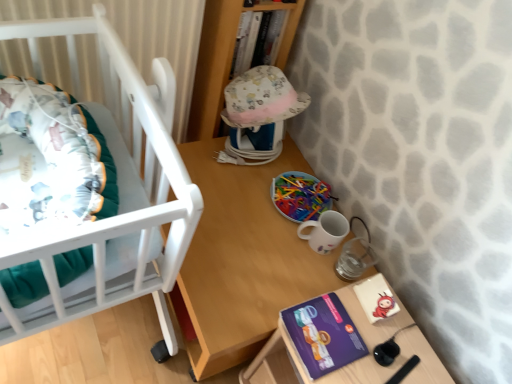
This screenshot has height=384, width=512. What do you see at coordinates (242, 260) in the screenshot? I see `wooden table at center` at bounding box center [242, 260].

In order to face hardcover book at upper center, should I rotate leftwards or rightwards?

Rotate your view left by about 0.839°.

The image size is (512, 384). I want to click on multicolored plastic sticks at center, so click(x=300, y=196).

Is wooden table at center smaller than white glossy mug at lower right?

Incorrect, wooden table at center is not smaller in size than white glossy mug at lower right.

Is point (281, 219) positioned behind point (311, 233)?

Yes, point (281, 219) is behind point (311, 233).

Considering the sizes of objects wooden table at center and white glossy mug at lower right in the image provided, who is taller, wooden table at center or white glossy mug at lower right?

With more height is wooden table at center.

From a real-world perspective, is purple cardboard box at lower right physically above white glossy mug at lower right?

No.

From the image's perspective, is purple cardboard box at lower right located above or below white glossy mug at lower right?

purple cardboard box at lower right is below white glossy mug at lower right.

Is purple cardboard box at lower right situated inside white glossy mug at lower right or outside?

purple cardboard box at lower right is not enclosed by white glossy mug at lower right.

Is purple cardboard box at lower right not near white glossy mug at lower right?

No.

Is multicolored plastic sticks at center not inside purple cardboard box at lower right?

multicolored plastic sticks at center is positioned outside purple cardboard box at lower right.

Is multicolored plastic sticks at center oriented away from purple cardboard box at lower right?

No, purple cardboard box at lower right is not at the back of multicolored plastic sticks at center.

Which object is further away from the camera taking this photo, multicolored plastic sticks at center or purple cardboard box at lower right?

multicolored plastic sticks at center.

Identify the location of changing table below the multicolored plastic sticks at center (from a real-world perspective). (356, 360).

Can you see purple matte paperback book at lower right touching white glossy mug at lower right?

No, purple matte paperback book at lower right is not beside white glossy mug at lower right.

Does purple matte paperback book at lower right have a lesser height compared to white glossy mug at lower right?

Indeed, purple matte paperback book at lower right has a lesser height compared to white glossy mug at lower right.

Is purple matte paperback book at lower right further to the viewer compared to white glossy mug at lower right?

No, purple matte paperback book at lower right is closer to the camera.

Locate an element on the screen. This screenshot has height=384, width=512. paperback book in front of the white glossy mug at lower right is located at coordinates (323, 334).

Between hardcover book at upper center and purple matte paperback book at lower right, which one is positioned behind?

Positioned behind is hardcover book at upper center.

Does hardcover book at upper center appear on the left side of purple matte paperback book at lower right?

Yes, hardcover book at upper center is to the left of purple matte paperback book at lower right.

Who is shorter, hardcover book at upper center or purple matte paperback book at lower right?

Standing shorter between the two is purple matte paperback book at lower right.

Is hardcover book at upper center positioned beyond the bounds of wooden table at center?

Indeed, hardcover book at upper center is completely outside wooden table at center.

From the image's perspective, which object appears higher, hardcover book at upper center or wooden table at center?

hardcover book at upper center.

Where is `book above the wooden table at center (from the image's perspective)`? book above the wooden table at center (from the image's perspective) is located at coordinates (258, 39).

Between purple matte paperback book at lower right and wooden table at center, which one has smaller size?

purple matte paperback book at lower right is smaller.

From the image's perspective, is purple matte paperback book at lower right over wooden table at center?

No, from the image's perspective, purple matte paperback book at lower right is not above wooden table at center.

Between purple matte paperback book at lower right and wooden table at center, which one appears on the right side from the viewer's perspective?

purple matte paperback book at lower right is more to the right.

Considering the sizes of objects purple matte paperback book at lower right and wooden table at center in the image provided, who is shorter, purple matte paperback book at lower right or wooden table at center?

purple matte paperback book at lower right.

This screenshot has width=512, height=384. What are the coordinates of `table lying in front of the white glossy mug at lower right` in the screenshot? It's located at (242, 260).

You are a GUI agent. You are given a task and a screenshot of the screen. Output one action in this format:
    pyautogui.click(x=<x>, y=<y>)
    Task: Click on the mug above the purple cardboard box at lower right (from a real-world perspective)
    This screenshot has width=512, height=384.
    Given the screenshot: What is the action you would take?
    pyautogui.click(x=325, y=231)

Which object lies nearer to the anchor point white glossy mug at lower right, hardcover book at upper center or purple matte paperback book at lower right?

purple matte paperback book at lower right is positioned closer to the anchor white glossy mug at lower right.

From the image, which object appears to be farther from purple matte paperback book at lower right, hardcover book at upper center or white glossy mug at lower right?

Based on the image, hardcover book at upper center appears to be further to purple matte paperback book at lower right.

Considering their positions, is hardcover book at upper center positioned further to wooden table at center than white glossy mug at lower right?

hardcover book at upper center is positioned further to the anchor wooden table at center.

Based on their spatial positions, is wooden table at center or white glossy mug at lower right further from purple matte paperback book at lower right?

wooden table at center.

When comparing their distances from purple cardboard box at lower right, does white glossy mug at lower right or wooden table at center seem closer?

wooden table at center is closer to purple cardboard box at lower right.

Which object lies nearer to the anchor point wooden table at center, multicolored plastic sticks at center or white glossy mug at lower right?

The object closer to wooden table at center is multicolored plastic sticks at center.

Looking at the image, which one is located further to purple matte paperback book at lower right, hardcover book at upper center or purple cardboard box at lower right?

The object further to purple matte paperback book at lower right is hardcover book at upper center.

Based on their spatial positions, is wooden table at center or purple matte paperback book at lower right closer to white glossy mug at lower right?

Among the two, wooden table at center is located nearer to white glossy mug at lower right.

Where is `paperback book between wooden table at center and white glossy mug at lower right in the horizontal direction`? paperback book between wooden table at center and white glossy mug at lower right in the horizontal direction is located at coordinates (323, 334).

This screenshot has height=384, width=512. I want to click on mug between hardcover book at upper center and purple cardboard box at lower right vertically, so click(x=325, y=231).

This screenshot has height=384, width=512. What are the coordinates of `toy between wooden table at center and white glossy mug at lower right` in the screenshot? It's located at (300, 196).

Image resolution: width=512 pixels, height=384 pixels. Identify the location of mug between purple matte paperback book at lower right and multicolored plastic sticks at center in the front-back direction. (325, 231).